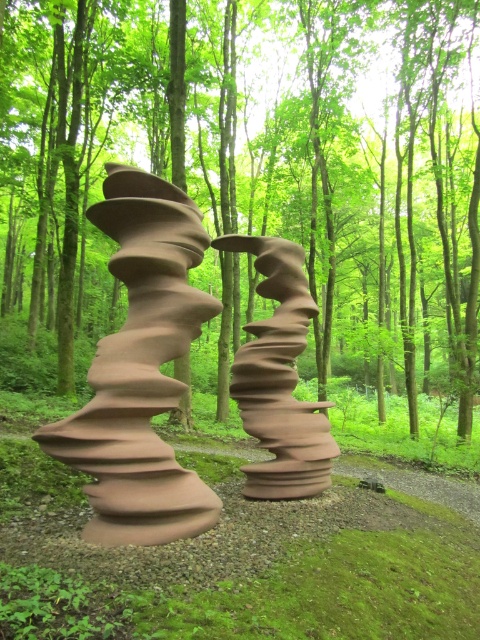
You are an art student standing in the forest and want to take a photo of both the matte brown sculpture at center and the matte clay sculpture at center. Which sculpture should you focus on first to ensure both are in the frame?

You should focus on the matte brown sculpture at center first since it is in front of the matte clay sculpture at center, ensuring both are visible in the frame.

You are an art student analyzing two sculptures in a forest. You notice the brown matte sculpture at center and the matte brown sculpture at center. Which sculpture is taller?

The brown matte sculpture at center is taller than the matte brown sculpture at center.